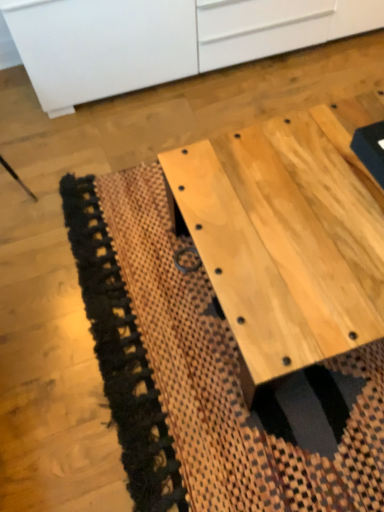
Question: From the image's perspective, does natural wood table at center appear lower than natural woven mat at center?

Choices:
 (A) no
 (B) yes

Answer: (A)

Question: Considering the relative positions of natural wood table at center and natural woven mat at center in the image provided, is natural wood table at center to the left of natural woven mat at center from the viewer's perspective?

Choices:
 (A) yes
 (B) no

Answer: (B)

Question: Can you confirm if natural wood table at center is bigger than natural woven mat at center?

Choices:
 (A) yes
 (B) no

Answer: (A)

Question: From a real-world perspective, is natural wood table at center below natural woven mat at center?

Choices:
 (A) no
 (B) yes

Answer: (A)

Question: Is natural wood table at center turned away from natural woven mat at center?

Choices:
 (A) yes
 (B) no

Answer: (B)

Question: Visually, is natural woven mat at center positioned to the left or to the right of white matte cabinet at upper center?

Choices:
 (A) right
 (B) left

Answer: (A)

Question: Is natural woven mat at center inside the boundaries of white matte cabinet at upper center, or outside?

Choices:
 (A) inside
 (B) outside

Answer: (B)

Question: Relative to white matte cabinet at upper center, is natural woven mat at center in front or behind?

Choices:
 (A) front
 (B) behind

Answer: (A)

Question: In terms of size, does natural woven mat at center appear bigger or smaller than white matte cabinet at upper center?

Choices:
 (A) big
 (B) small

Answer: (B)

Question: From the image's perspective, relative to natural wood table at center, is natural woven mat at center above or below?

Choices:
 (A) below
 (B) above

Answer: (A)

Question: In terms of size, does natural woven mat at center appear bigger or smaller than natural wood table at center?

Choices:
 (A) big
 (B) small

Answer: (B)

Question: Is natural woven mat at center wider or thinner than natural wood table at center?

Choices:
 (A) wide
 (B) thin

Answer: (A)

Question: Relative to natural wood table at center, is natural woven mat at center in front or behind?

Choices:
 (A) front
 (B) behind

Answer: (B)

Question: From a real-world perspective, is natural wood table at center physically located above or below white matte cabinet at upper center?

Choices:
 (A) below
 (B) above

Answer: (A)

Question: In the image, is natural wood table at center on the left side or the right side of white matte cabinet at upper center?

Choices:
 (A) left
 (B) right

Answer: (B)